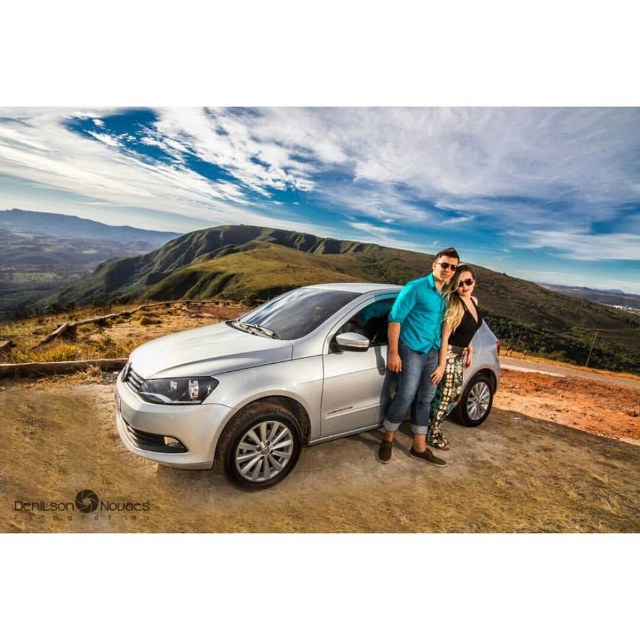
You are a photographer trying to capture a closeup of the teal fabric shirt at center and printed fabric pants at center. Can you fit both items into a camera frame that has a maximum width of 14 inches?

The teal fabric shirt at center and printed fabric pants at center are 14.79 inches apart, which exceeds the camera frame width of 14 inches. Therefore, you cannot fit both items into the frame.

You are a photographer trying to capture a photo of the satin silver car at center and the printed fabric pants at center. Since you want to emphasize the car, which object should you focus on first and why?

You should focus on the satin silver car at center first because it is larger in size compared to the printed fabric pants at center, making it the more prominent subject to emphasize.